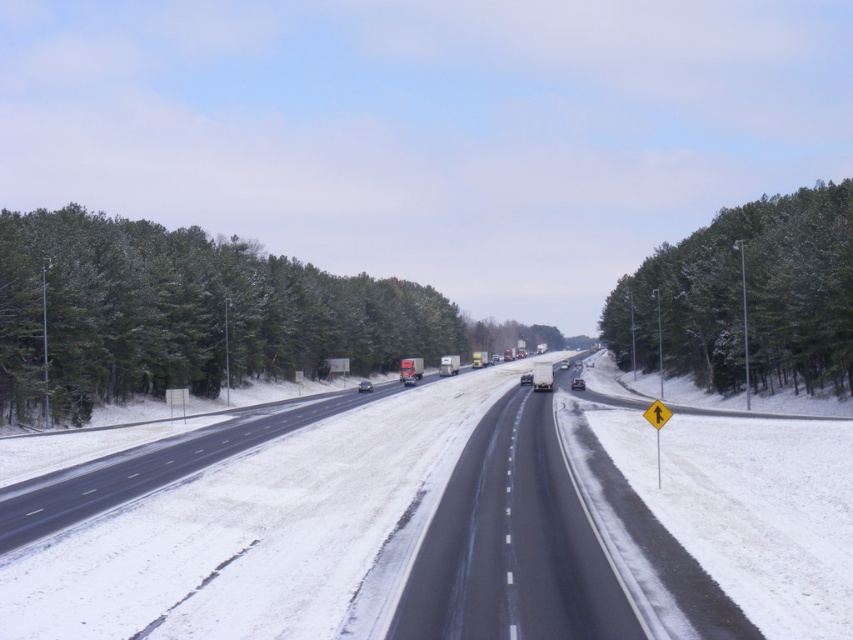
You are a driver planning to take a photo of the green textured trees at right and the black asphalt highway at center from your car window. Which object will appear larger in the photo?

The green textured trees at right will appear larger in the photo because they are taller than the black asphalt highway at center.